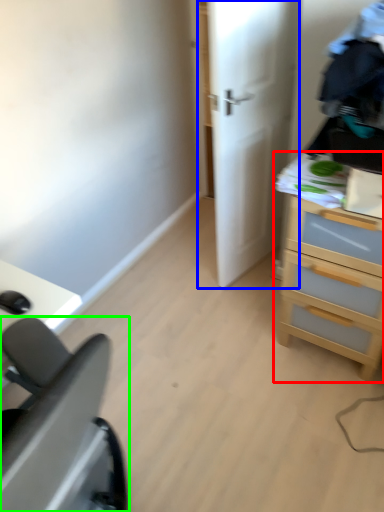
Question: Which is farther away from chest of drawers (highlighted by a red box)? door (highlighted by a blue box) or furniture (highlighted by a green box)?

Choices:
 (A) door
 (B) furniture

Answer: (B)